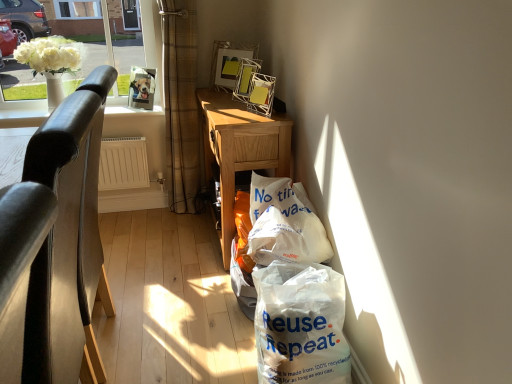
The width and height of the screenshot is (512, 384). I want to click on vacant area that lies between brown plaid curtain at upper left and wooden desk at center, so click(x=189, y=238).